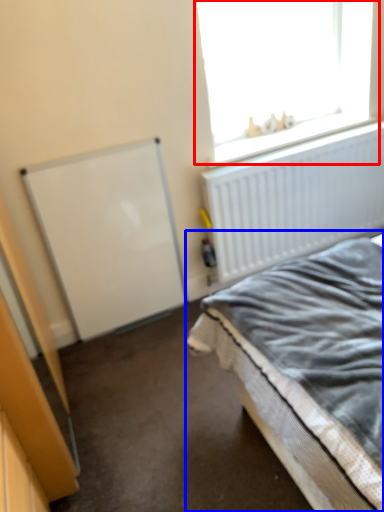
Question: Which object appears closest to the camera in this image, window (highlighted by a red box) or bed (highlighted by a blue box)?

Choices:
 (A) window
 (B) bed

Answer: (B)